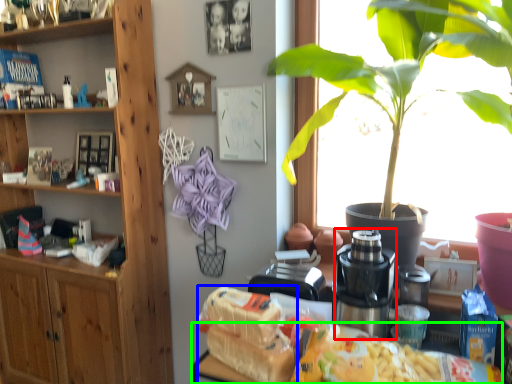
Question: Based on their relative distances, which object is nearer to coffee machine (highlighted by a red box)? Choose from food (highlighted by a blue box) and desk (highlighted by a green box).

Choices:
 (A) food
 (B) desk

Answer: (B)